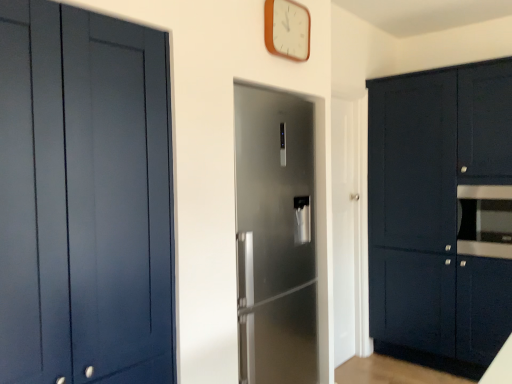
At what (x,y) coordinates should I click in order to perform the action: click on free space above matte blue cabinet at left, the 2th cabinetry viewed from the right (from a real-world perspective). Please return your answer as a coordinate pair (x, y). This screenshot has height=384, width=512. Looking at the image, I should click on (106, 9).